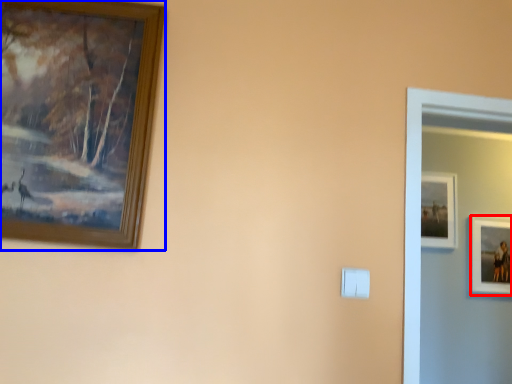
Question: Which of the following is the closest to the observer, picture frame (highlighted by a red box) or picture frame (highlighted by a blue box)?

Choices:
 (A) picture frame
 (B) picture frame

Answer: (B)